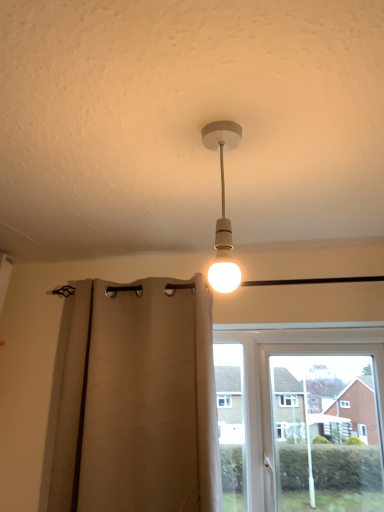
Question: Can you confirm if white matte bulb at center is wider than beige fabric curtain at center?

Choices:
 (A) yes
 (B) no

Answer: (B)

Question: Can you confirm if white matte bulb at center is positioned to the right of beige fabric curtain at center?

Choices:
 (A) yes
 (B) no

Answer: (A)

Question: Can you confirm if white matte bulb at center is taller than beige fabric curtain at center?

Choices:
 (A) yes
 (B) no

Answer: (B)

Question: Is white matte bulb at center oriented away from beige fabric curtain at center?

Choices:
 (A) yes
 (B) no

Answer: (B)

Question: Are white matte bulb at center and beige fabric curtain at center making contact?

Choices:
 (A) yes
 (B) no

Answer: (B)

Question: Can you confirm if white matte bulb at center is bigger than beige fabric curtain at center?

Choices:
 (A) yes
 (B) no

Answer: (B)

Question: Does beige fabric curtain at center have a lesser height compared to white matte bulb at center?

Choices:
 (A) yes
 (B) no

Answer: (B)

Question: From the image's perspective, is beige fabric curtain at center located above white matte bulb at center?

Choices:
 (A) yes
 (B) no

Answer: (B)

Question: From a real-world perspective, is beige fabric curtain at center under white matte bulb at center?

Choices:
 (A) yes
 (B) no

Answer: (A)

Question: Is beige fabric curtain at center in contact with white matte bulb at center?

Choices:
 (A) yes
 (B) no

Answer: (B)

Question: Is beige fabric curtain at center oriented towards white matte bulb at center?

Choices:
 (A) yes
 (B) no

Answer: (A)

Question: Is beige fabric curtain at center oriented away from white matte bulb at center?

Choices:
 (A) no
 (B) yes

Answer: (A)

Question: Is the depth of white matte bulb at center greater than that of white plastic window at center?

Choices:
 (A) yes
 (B) no

Answer: (B)